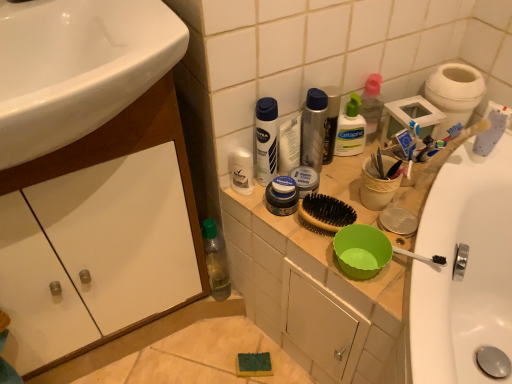
At what (x,y) coordinates should I click in order to perform the action: click on free point to the right of metallic silver deodorant at upper center, the 3th toiletry viewed from the left. Please return your answer as a coordinate pair (x, y). Looking at the image, I should click on (360, 176).